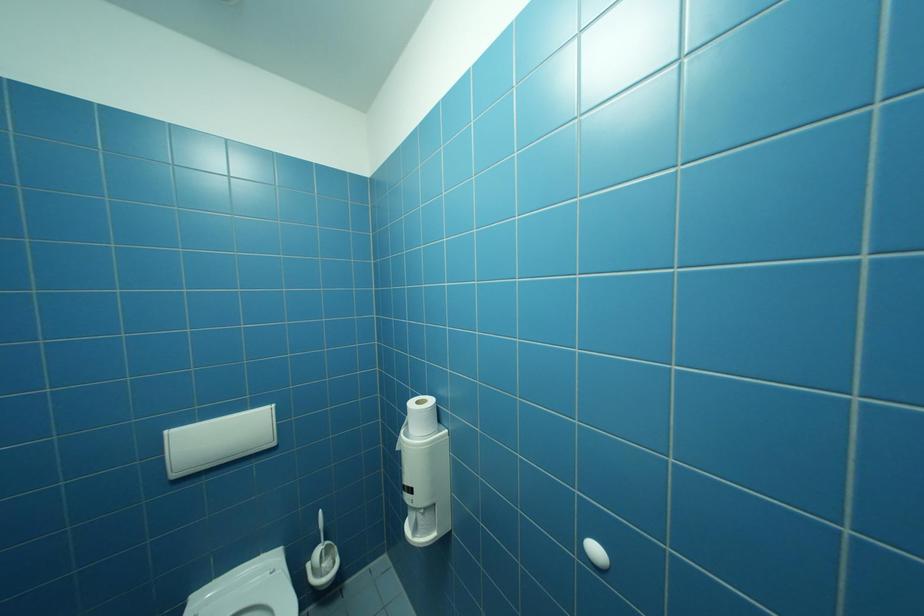
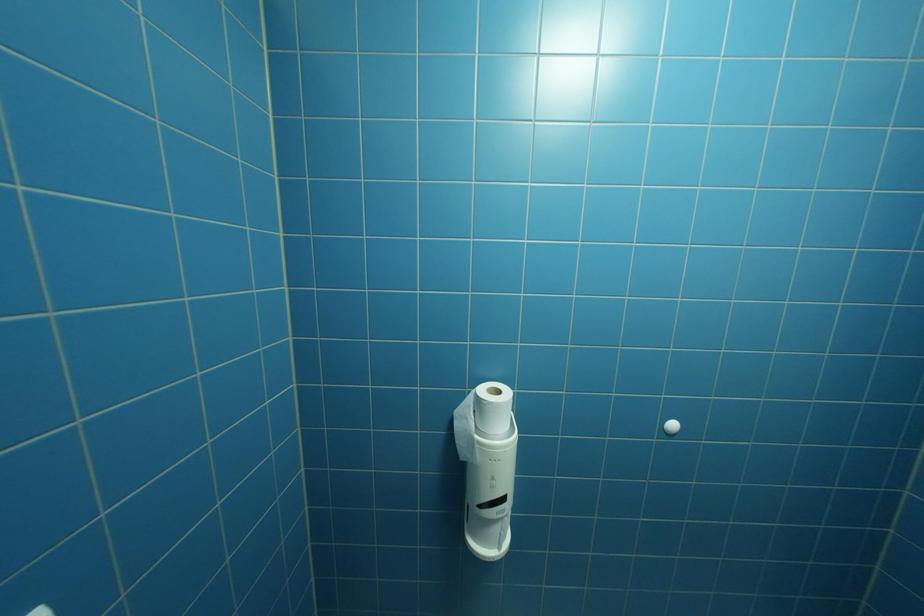
Question: Based on the continuous images, in which direction is the camera rotating? Reply with the corresponding letter.

Choices:
 (A) Left
 (B) Right
 (C) Up
 (D) Down

Answer: (B)